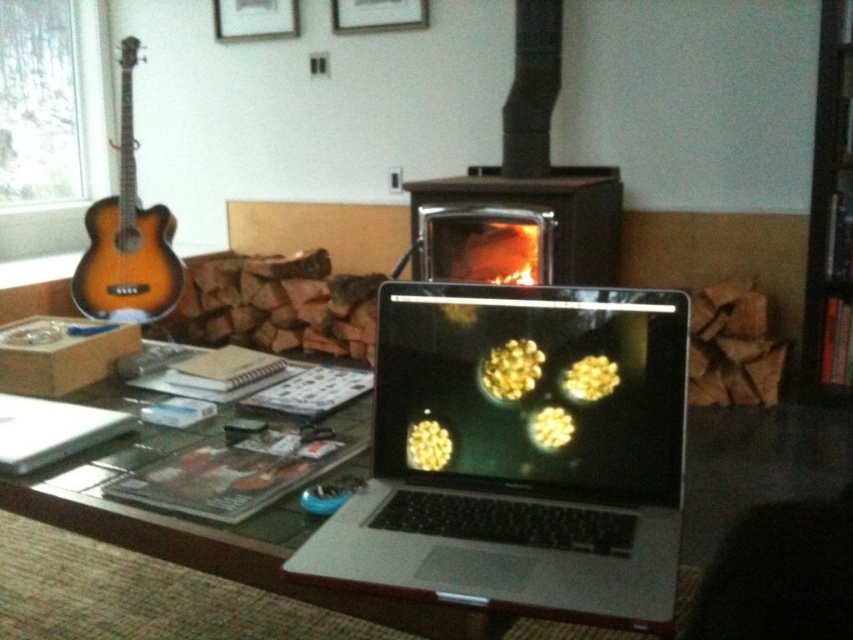
From the picture: You are looking at the image of the table with the laptop and other items. There are two points marked on the table surface. The first point is at coordinates point (740, 472) and the second is at point (553, 280). If you were to place a small sticker on both points, which point would be closer to you when viewed from your current position?

Point (740, 472) is in front of point (553, 280), so the sticker placed on point (740, 472) would be closer to you when viewed from your current position.

You are organizing a desk and need to place both the silver metallic laptop at center and the brushed metal picture frame at upper center. Given their sizes, which one should you place first to ensure they both fit on the desk?

The silver metallic laptop at center is larger in size than the brushed metal picture frame at upper center, so you should place the silver metallic laptop at center first to ensure there is enough space for both items on the desk.

You are standing in the room and want to take a photo of the point at coordinates point [540,502]. If your camera is 36.18 inches away from that point, will you be able to capture it clearly in your photo?

Yes, since the camera is exactly 36.18 inches away from the point [540,502], which is within a typical focusing range for most cameras, so the point should be captured clearly.